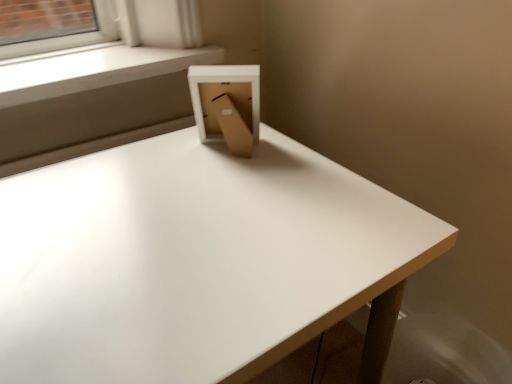
The image size is (512, 384). In order to click on free space to the right of cardboard box at center in this screenshot , I will do `click(301, 165)`.